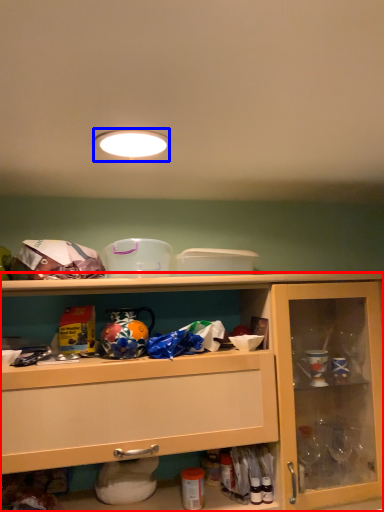
Question: Which point is closer to the camera, cabinetry (highlighted by a red box) or lighting (highlighted by a blue box)?

Choices:
 (A) cabinetry
 (B) lighting

Answer: (B)